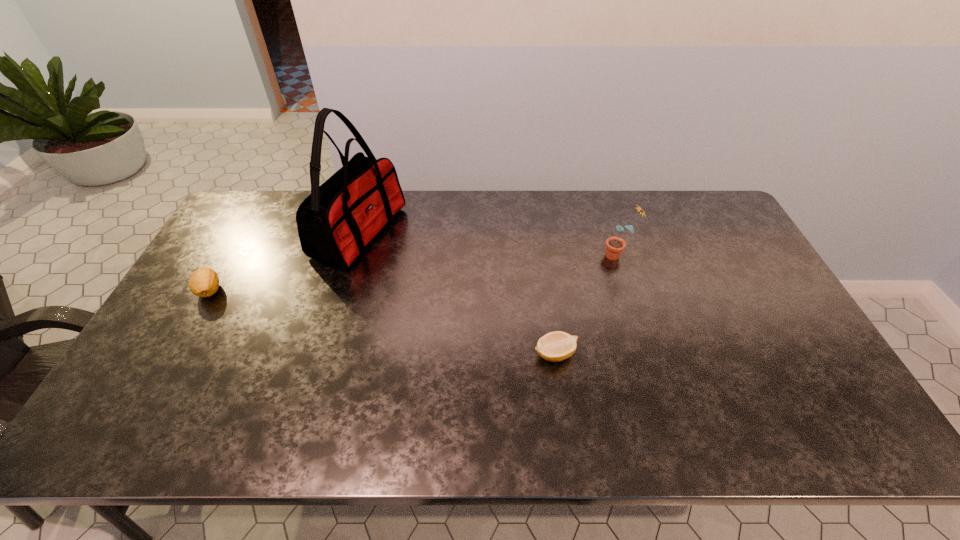
The height and width of the screenshot is (540, 960). I want to click on vacant space positioned 0.380m on the flower of the third shortest object, so click(x=484, y=255).

The height and width of the screenshot is (540, 960). Find the location of `free space located on the flower of the third shortest object`. free space located on the flower of the third shortest object is located at coordinates (490, 255).

In order to click on vacant region located at the stem end of the third tallest object in this screenshot , I will do `click(154, 388)`.

Find the location of a particular element. vacant space located 0.150m on the front of the nearer lemon is located at coordinates (564, 424).

This screenshot has width=960, height=540. What are the coordinates of `object that is at the far edge` in the screenshot? It's located at (337, 221).

Locate an element on the screen. object at the left edge is located at coordinates (204, 282).

The width and height of the screenshot is (960, 540). Identify the location of free space at the far edge. (603, 226).

The image size is (960, 540). Identify the location of free spot at the near edge of the desktop. (528, 428).

Identify the location of vacant space at the left edge of the desktop. Image resolution: width=960 pixels, height=540 pixels. (223, 302).

Where is `blank space at the right edge of the desktop`? The height and width of the screenshot is (540, 960). blank space at the right edge of the desktop is located at coordinates (757, 332).